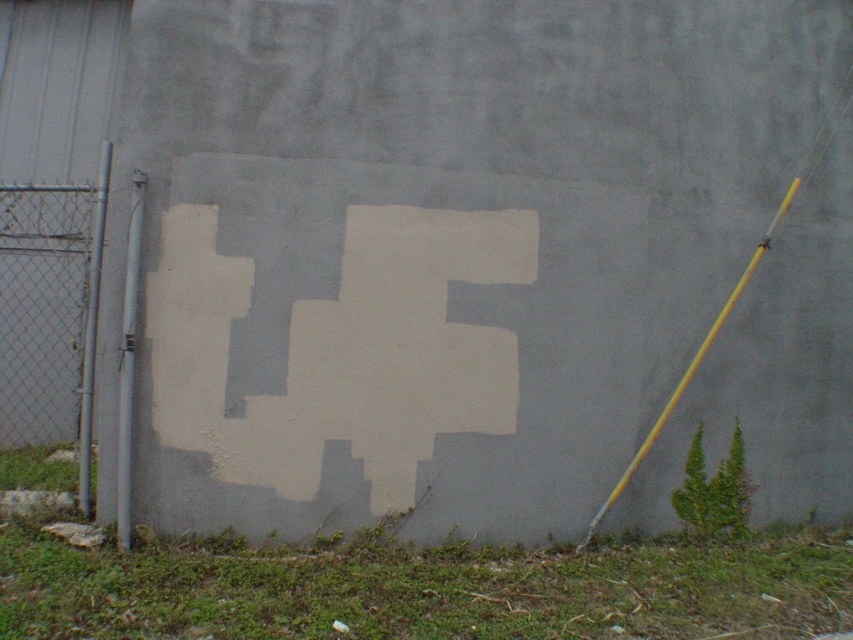
Who is higher up, white matte cross at center or brushed metal fence at left?

brushed metal fence at left is higher up.

Does white matte cross at center appear over brushed metal fence at left?

No.

Measure the distance between white matte cross at center and camera.

white matte cross at center is 5.49 meters away from camera.

I want to click on white matte cross at center, so click(340, 348).